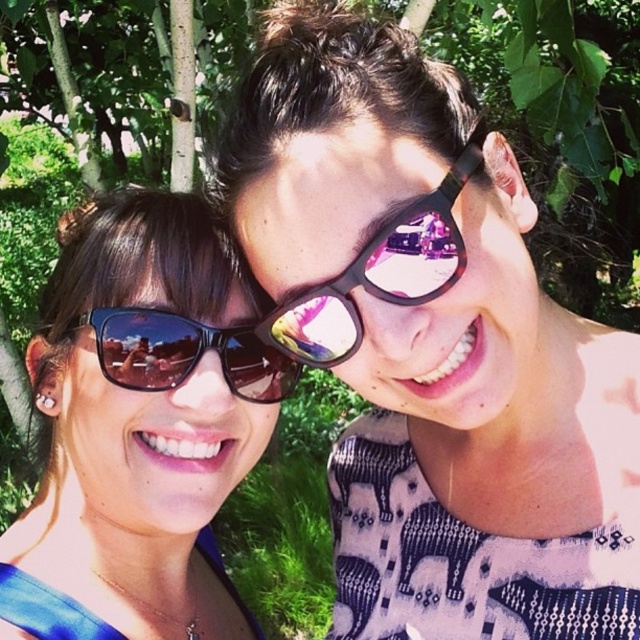
Question: Considering the relative positions of matte black sunglasses at left and sunglasses at center in the image provided, where is matte black sunglasses at left located with respect to sunglasses at center?

Choices:
 (A) left
 (B) right

Answer: (A)

Question: Is the position of matte black sunglasses at left more distant than that of sunglasses at center?

Choices:
 (A) yes
 (B) no

Answer: (B)

Question: Estimate the real-world distances between objects in this image. Which object is farther from the sunglasses at center?

Choices:
 (A) black reflective sunglasses at center
 (B) matte black sunglasses at upper right
 (C) matte black sunglasses at left

Answer: (B)

Question: Considering the real-world distances, which object is closest to the black reflective sunglasses at center?

Choices:
 (A) matte black sunglasses at upper right
 (B) matte black sunglasses at left
 (C) sunglasses at center

Answer: (A)

Question: Among these points, which one is farthest from the camera?

Choices:
 (A) (480, 294)
 (B) (115, 426)
 (C) (412, 237)

Answer: (B)

Question: Is matte black sunglasses at upper right closer to camera compared to matte black sunglasses at left?

Choices:
 (A) yes
 (B) no

Answer: (A)